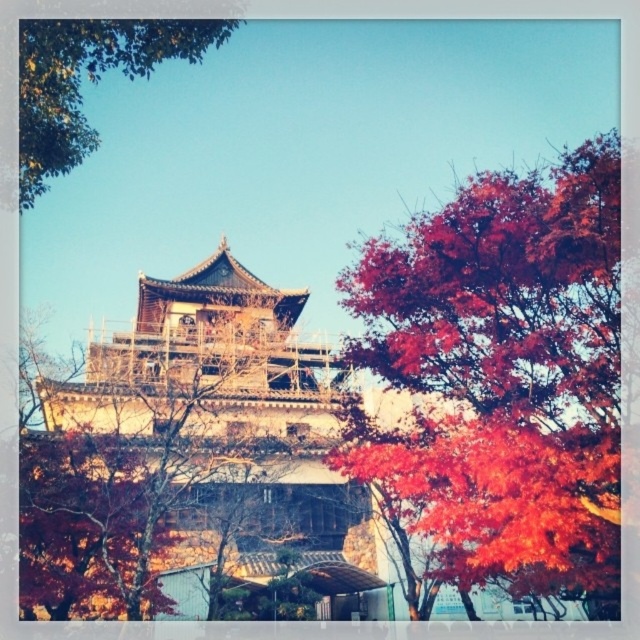
Question: Which object is closer to the camera taking this photo?

Choices:
 (A) green leafy tree at upper left
 (B) vivid crimson leaves at right

Answer: (A)

Question: Is vivid crimson leaves at right wider than green leafy tree at upper left?

Choices:
 (A) yes
 (B) no

Answer: (A)

Question: Does vivid crimson leaves at right have a smaller size compared to green leafy tree at upper left?

Choices:
 (A) no
 (B) yes

Answer: (A)

Question: Which point is closer to the camera taking this photo?

Choices:
 (A) (531, 417)
 (B) (28, 96)

Answer: (B)

Question: Where is vivid crimson leaves at right located in relation to green leafy tree at upper left in the image?

Choices:
 (A) left
 (B) right

Answer: (B)